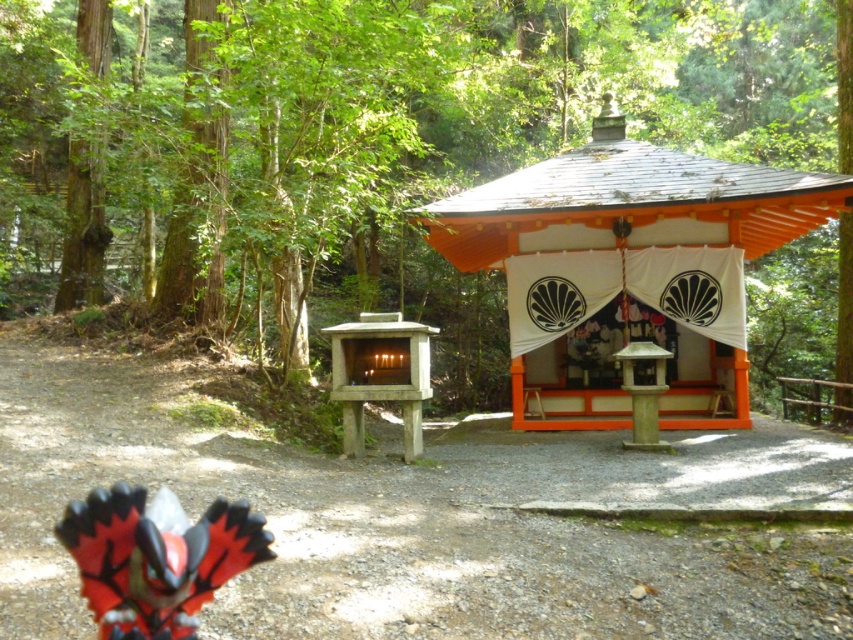
Question: Which of the following is the closest to the observer?

Choices:
 (A) (663, 604)
 (B) (380, 108)
 (C) (727, 227)
 (D) (381, 380)

Answer: (A)

Question: Can you confirm if green wood tree at upper left is bigger than orange wood gazebo at center?

Choices:
 (A) yes
 (B) no

Answer: (A)

Question: Where is green wood tree at upper left located in relation to dirt path at center in the image?

Choices:
 (A) above
 (B) below

Answer: (A)

Question: Considering the real-world distances, which object is closest to the dirt path at center?

Choices:
 (A) orange wood gazebo at center
 (B) smooth concrete shrine at center
 (C) green wood tree at upper left

Answer: (B)

Question: Is green wood tree at upper left smaller than orange wood gazebo at center?

Choices:
 (A) yes
 (B) no

Answer: (B)

Question: Estimate the real-world distances between objects in this image. Which object is farther from the dirt path at center?

Choices:
 (A) green wood tree at upper left
 (B) orange wood gazebo at center
 (C) smooth concrete shrine at center

Answer: (A)